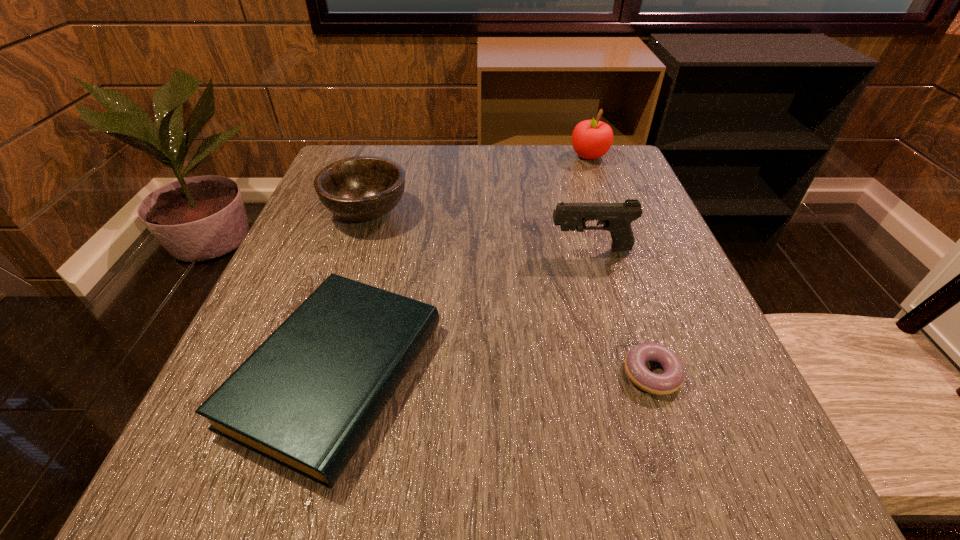
Where is `free spot between the pistol and the shortest object`? This screenshot has height=540, width=960. free spot between the pistol and the shortest object is located at coordinates (621, 312).

I want to click on unoccupied position between the fourth nearest object and the third nearest object, so tap(479, 230).

At what (x,y) coordinates should I click in order to perform the action: click on empty space that is in between the apple and the third farthest object. Please return your answer as a coordinate pair (x, y). Looking at the image, I should click on (589, 202).

Find the location of `vacant area that lies between the pistol and the third shortest object`. vacant area that lies between the pistol and the third shortest object is located at coordinates [479, 230].

Image resolution: width=960 pixels, height=540 pixels. Identify the location of vacant space that's between the book and the third nearest object. (464, 311).

The image size is (960, 540). I want to click on free spot between the third nearest object and the book, so click(464, 311).

The height and width of the screenshot is (540, 960). What are the coordinates of `free spot between the farthest object and the third tallest object` in the screenshot? It's located at (478, 184).

Identify the location of empty space that is in between the apple and the shortest object. 620,265.

Choose which object is the third nearest neighbor to the pistol. Please provide its 2D coordinates. Your answer should be formatted as a tuple, i.e. [(x, y)], where the tuple contains the x and y coordinates of a point satisfying the conditions above.

[(361, 188)]

Point out which object is positioned as the fourth nearest to the farthest object. Please provide its 2D coordinates. Your answer should be formatted as a tuple, i.e. [(x, y)], where the tuple contains the x and y coordinates of a point satisfying the conditions above.

[(671, 380)]